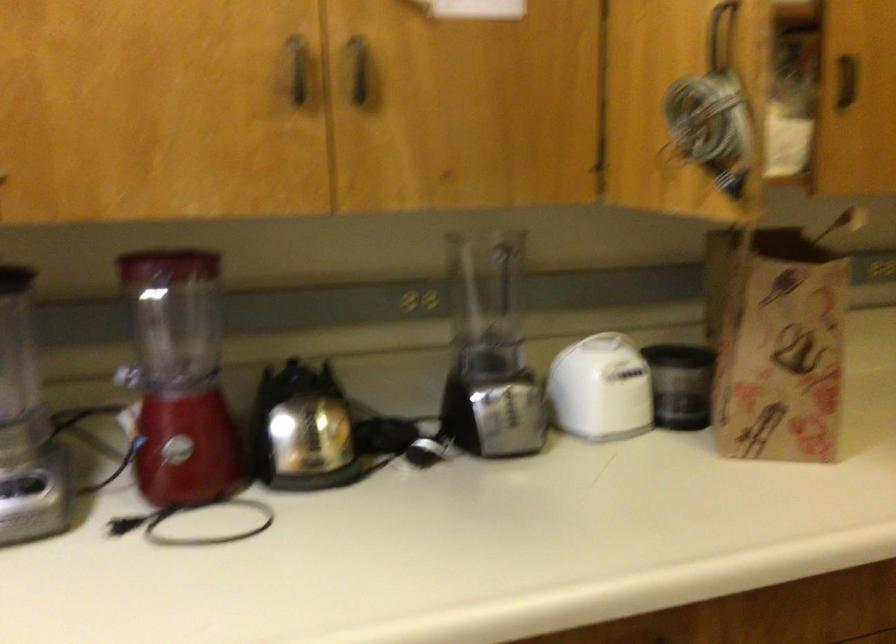
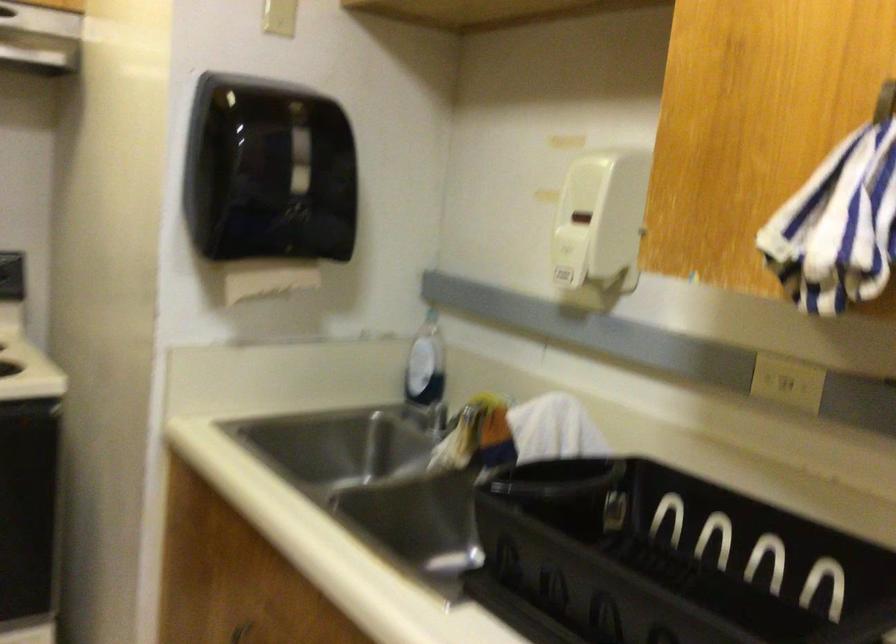
Question: The first image is from the beginning of the video and the second image is from the end. How did the camera likely rotate when shooting the video?

Choices:
 (A) Left
 (B) Right
 (C) Up
 (D) Down

Answer: (B)